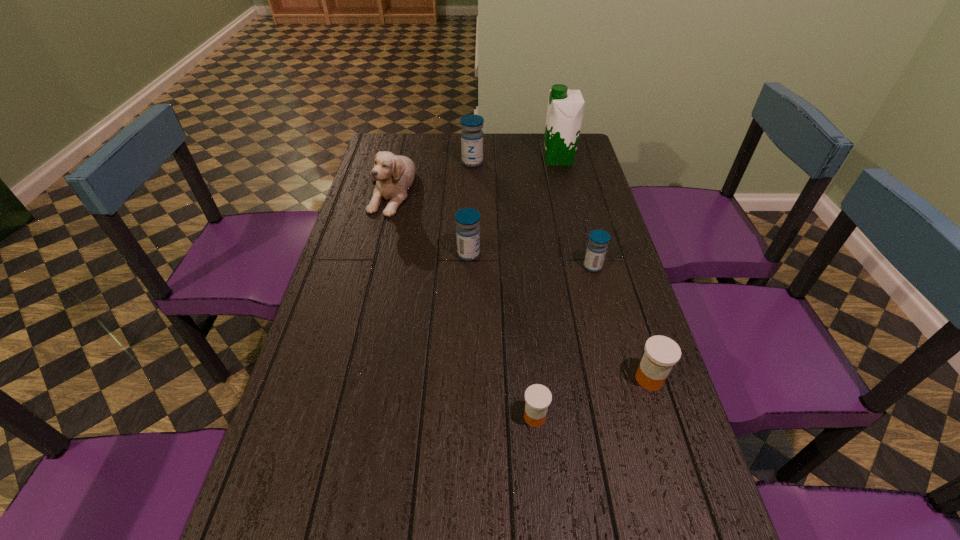
Where is `vacant region located 0.280m on the label of the fourth farthest medicine`? vacant region located 0.280m on the label of the fourth farthest medicine is located at coordinates (695, 526).

The height and width of the screenshot is (540, 960). In order to click on free space located 0.280m on the label of the nearer orange medicine in this screenshot , I will do `click(396, 417)`.

What are the coordinates of `vacant space positioned 0.220m on the label of the nearer orange medicine` in the screenshot? It's located at (423, 417).

Identify the location of free space located 0.310m on the label of the nearer orange medicine. Image resolution: width=960 pixels, height=540 pixels. (383, 417).

Locate an element on the screen. The image size is (960, 540). soya milk at the far edge is located at coordinates click(565, 109).

Find the location of a particular element. This screenshot has width=960, height=540. medicine positioned at the far edge is located at coordinates (471, 136).

Locate an element on the screen. This screenshot has width=960, height=540. object at the left edge is located at coordinates (394, 174).

Identify the location of soya milk at the right edge. (565, 109).

Locate an element on the screen. This screenshot has height=540, width=960. object present at the far right corner is located at coordinates (565, 109).

At what (x,y) coordinates should I click in order to perform the action: click on vacant position at the far edge of the desktop. Please return your answer as a coordinate pair (x, y). This screenshot has width=960, height=540. Looking at the image, I should click on (445, 136).